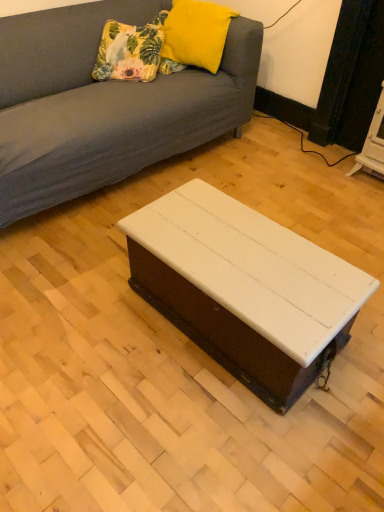
Question: Is floral fabric cushion at upper left, arranged as the second pillow when viewed from the right, not within yellow fuzzy pillow at upper center, which appears as the second pillow when viewed from the left?

Choices:
 (A) no
 (B) yes

Answer: (B)

Question: From the image's perspective, is floral fabric cushion at upper left, the 1th pillow when ordered from left to right, below yellow fuzzy pillow at upper center, which appears as the second pillow when viewed from the left?

Choices:
 (A) no
 (B) yes

Answer: (B)

Question: Does floral fabric cushion at upper left, arranged as the second pillow when viewed from the right, have a lesser width compared to yellow fuzzy pillow at upper center, marked as the first pillow in a right-to-left arrangement?

Choices:
 (A) yes
 (B) no

Answer: (B)

Question: Is floral fabric cushion at upper left, arranged as the second pillow when viewed from the right, positioned with its back to yellow fuzzy pillow at upper center, which appears as the second pillow when viewed from the left?

Choices:
 (A) no
 (B) yes

Answer: (A)

Question: Considering the relative sizes of floral fabric cushion at upper left, arranged as the second pillow when viewed from the right, and yellow fuzzy pillow at upper center, marked as the first pillow in a right-to-left arrangement, in the image provided, is floral fabric cushion at upper left, arranged as the second pillow when viewed from the right, smaller than yellow fuzzy pillow at upper center, marked as the first pillow in a right-to-left arrangement,?

Choices:
 (A) no
 (B) yes

Answer: (B)

Question: Is floral fabric cushion at upper left, arranged as the second pillow when viewed from the right, wider than yellow fuzzy pillow at upper center, which appears as the second pillow when viewed from the left?

Choices:
 (A) yes
 (B) no

Answer: (A)

Question: Is the position of white painted wood coffee table at center more distant than that of yellow fuzzy pillow at upper center, marked as the first pillow in a right-to-left arrangement?

Choices:
 (A) no
 (B) yes

Answer: (A)

Question: Is white painted wood coffee table at center far away from yellow fuzzy pillow at upper center, which appears as the second pillow when viewed from the left?

Choices:
 (A) no
 (B) yes

Answer: (B)

Question: Is yellow fuzzy pillow at upper center, which appears as the second pillow when viewed from the left, a part of white painted wood coffee table at center?

Choices:
 (A) yes
 (B) no

Answer: (B)

Question: Is white painted wood coffee table at center to the right of yellow fuzzy pillow at upper center, which appears as the second pillow when viewed from the left, from the viewer's perspective?

Choices:
 (A) yes
 (B) no

Answer: (A)

Question: Is white painted wood coffee table at center turned away from yellow fuzzy pillow at upper center, which appears as the second pillow when viewed from the left?

Choices:
 (A) yes
 (B) no

Answer: (B)

Question: Is white painted wood coffee table at center taller than yellow fuzzy pillow at upper center, which appears as the second pillow when viewed from the left?

Choices:
 (A) yes
 (B) no

Answer: (A)

Question: From the image's perspective, is white painted wood coffee table at center above floral fabric cushion at upper left, the 1th pillow when ordered from left to right?

Choices:
 (A) yes
 (B) no

Answer: (B)